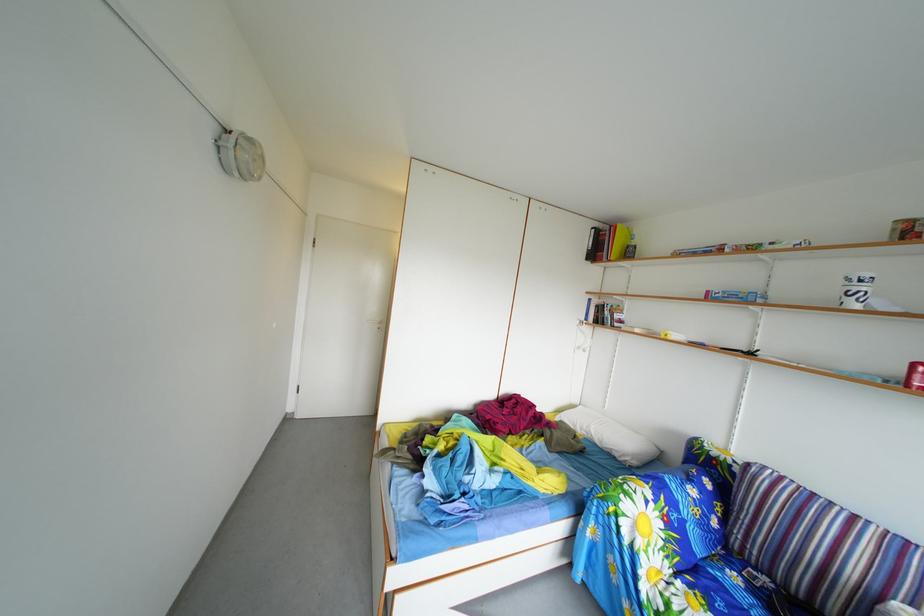
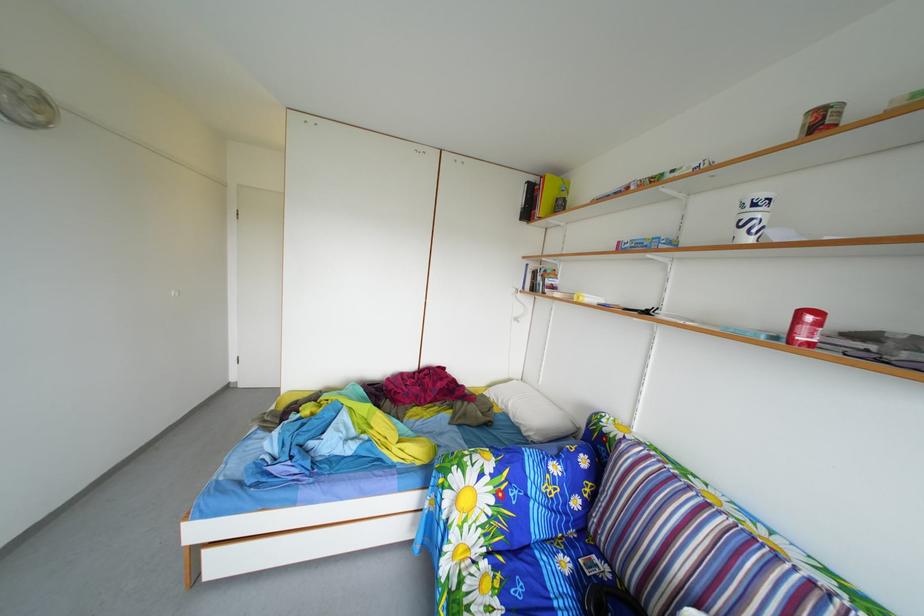
Find the pixel in the second image that matches pixel 746 585 in the first image.

(576, 570)